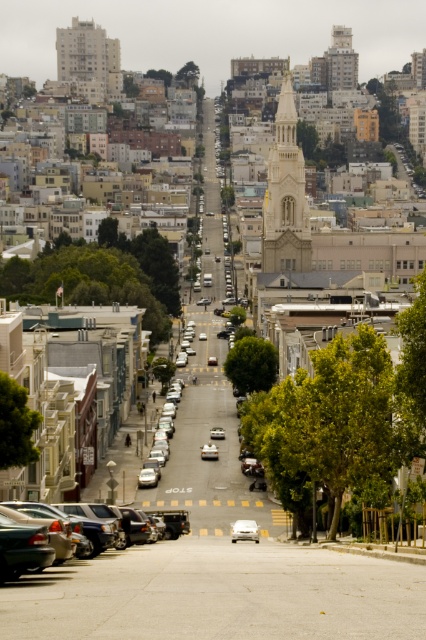
Question: Which object appears closest to the camera in this image?

Choices:
 (A) matte black sedan at lower left
 (B) white stone tower at upper center
 (C) white matte car at center
 (D) white glossy car at center

Answer: (A)

Question: Which of the following is the closest to the observer?

Choices:
 (A) gray concrete building at upper left
 (B) white matte car at center

Answer: (B)

Question: Based on their relative distances, which object is farther from the matte black sedan at lower left?

Choices:
 (A) gray concrete building at upper left
 (B) gold textured tower at center
 (C) white matte car at center

Answer: (A)

Question: Does gold textured tower at center lie in front of white glossy car at center?

Choices:
 (A) no
 (B) yes

Answer: (A)

Question: Does matte black sedan at lower left lie in front of white glossy car at center?

Choices:
 (A) no
 (B) yes

Answer: (B)

Question: Does gold textured tower at center have a greater width compared to white glossy car at center?

Choices:
 (A) no
 (B) yes

Answer: (B)